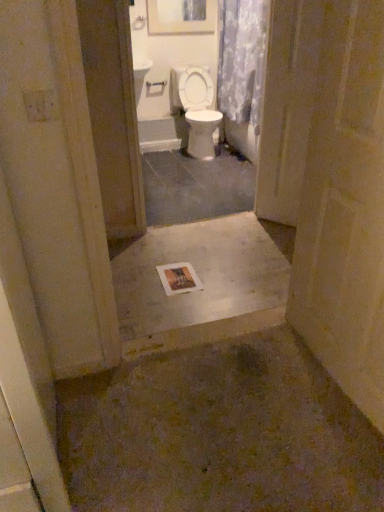
Image resolution: width=384 pixels, height=512 pixels. Find the location of `vacant space situated on the left part of clear plastic screen door at center`. vacant space situated on the left part of clear plastic screen door at center is located at coordinates (250, 225).